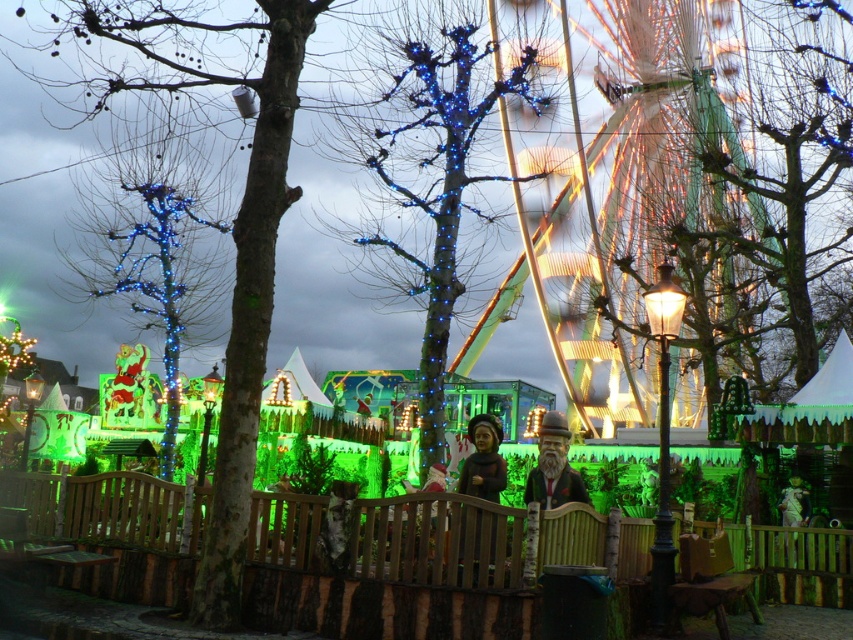
Between illuminated metal ferris wheel at upper right and wooden statue at center, which one is positioned lower?

wooden statue at center is lower down.

Where is `illuminated metal ferris wheel at upper right`? This screenshot has width=853, height=640. illuminated metal ferris wheel at upper right is located at coordinates (695, 198).

At what (x,y) coordinates should I click in order to perform the action: click on illuminated metal ferris wheel at upper right. Please return your answer as a coordinate pair (x, y). The height and width of the screenshot is (640, 853). Looking at the image, I should click on (695, 198).

At what (x,y) coordinates should I click in order to perform the action: click on blue metallic tree at left. Please return your answer as a coordinate pair (x, y). This screenshot has height=640, width=853. Looking at the image, I should click on (236, 262).

Is blue metallic tree at left wider than blue illuminated tree at left?

Yes, blue metallic tree at left is wider than blue illuminated tree at left.

Where is `blue metallic tree at left`? The height and width of the screenshot is (640, 853). blue metallic tree at left is located at coordinates (236, 262).

Does point (96, 241) come in front of point (581, 483)?

That is False.

Does point (171, 264) lie behind point (549, 412)?

Yes, it is.

Identify the location of blue illuminated tree at left. This screenshot has width=853, height=640. coord(155,237).